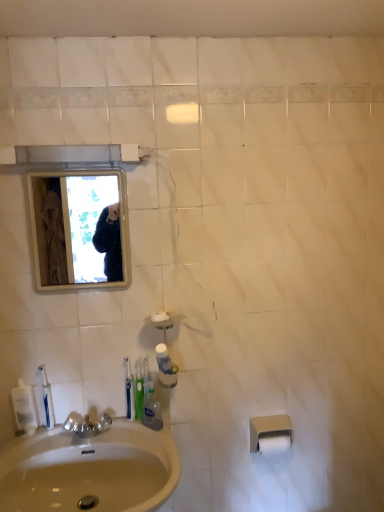
At what (x,y) coordinates should I click in order to perform the action: click on vacant area that lies in front of translucent plastic mouthwash at lower center, the first mouthwash from the right. Please return your answer as a coordinate pair (x, y). Looking at the image, I should click on click(x=153, y=442).